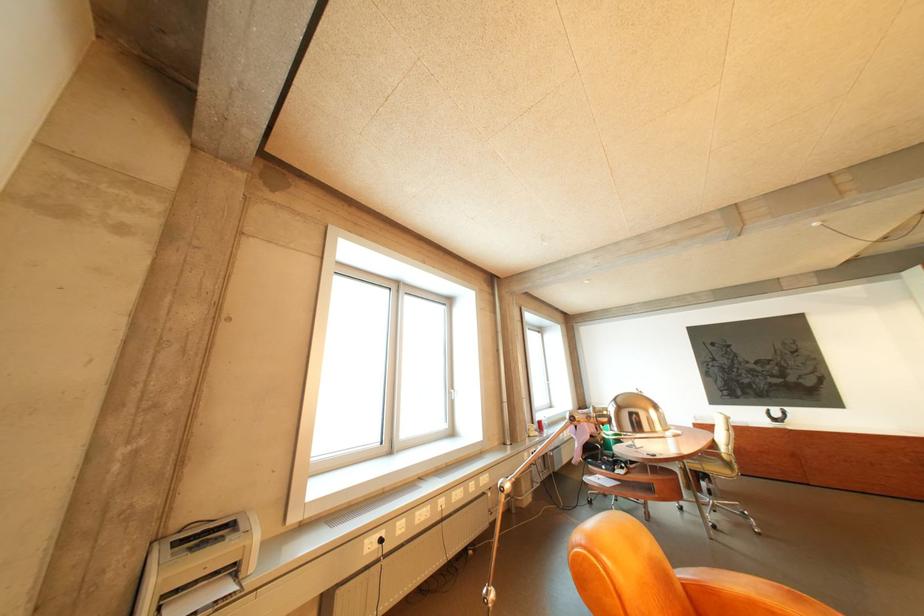
Identify the location of silver lamp head. (637, 416).